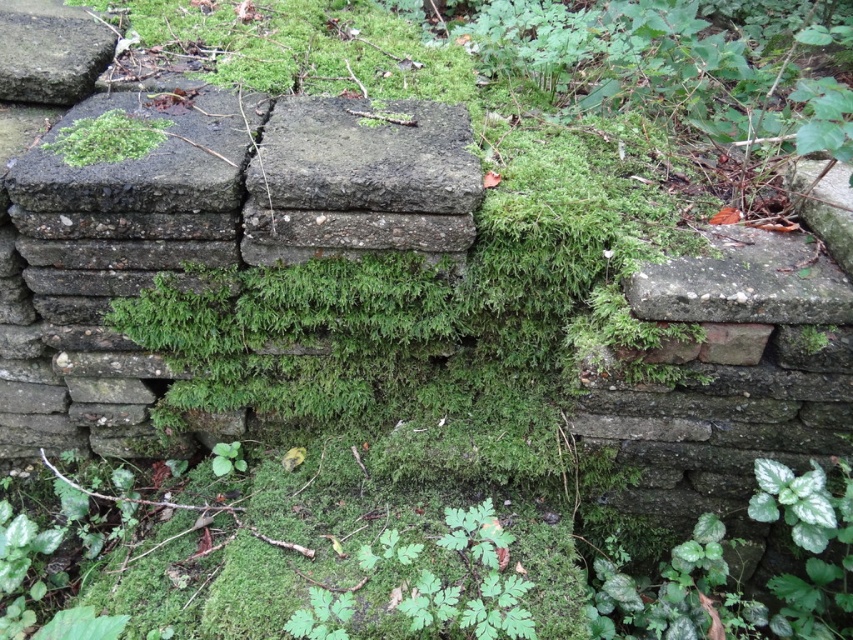
Describe the element at coordinates (50, 51) in the screenshot. I see `smooth gray stone at upper left` at that location.

Identify the location of smooth gray stone at upper left. This screenshot has height=640, width=853. (50, 51).

Is rough concrete block at center in front of green mossy patch at upper left?

That is True.

Can you confirm if rough concrete block at center is positioned above green mossy patch at upper left?

No.

This screenshot has height=640, width=853. Find the location of `rough concrete block at center`. rough concrete block at center is located at coordinates (364, 156).

Can you confirm if rough concrete block at center is positioned to the right of smooth gray stone at upper left?

Correct, you'll find rough concrete block at center to the right of smooth gray stone at upper left.

Measure the distance from rough concrete block at center to smooth gray stone at upper left.

They are 25.95 inches apart.

Is point (287, 180) positioned behind point (35, 17)?

No, (287, 180) is closer to viewer.

The width and height of the screenshot is (853, 640). Find the location of `rough concrete block at center`. rough concrete block at center is located at coordinates (364, 156).